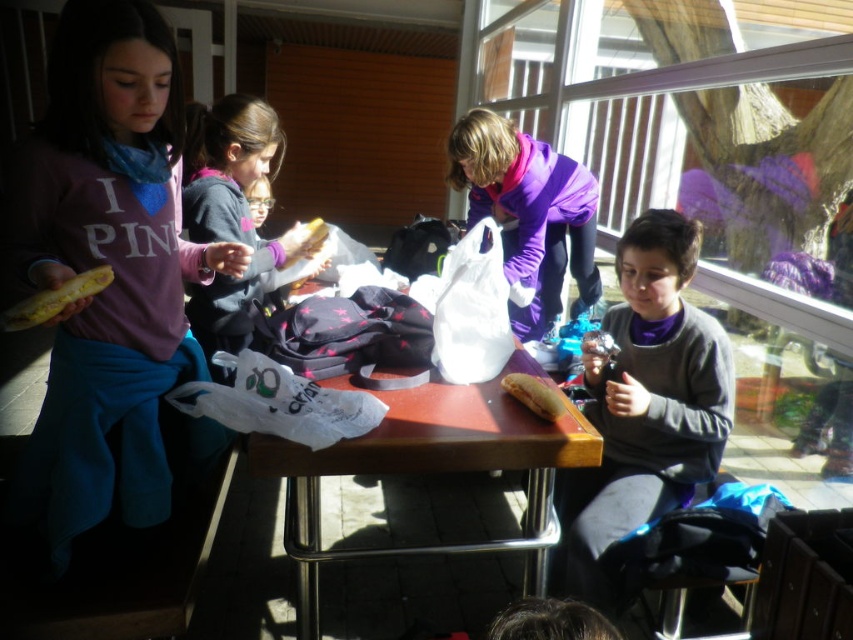
The scene shows a group of children around a table. There is a point marked at coordinates (645, 403). What object is located at that point?

The point at (645, 403) marks the gray matte sweater at center.

You are a photographer trying to capture a closeup of the yellow matte sandwich at center without the matte purple sweatshirt at left blocking the view. Given their sizes, do you think you can position yourself to frame the sandwich without the sweatshirt overlapping?

The matte purple sweatshirt at left is larger in size than the yellow matte sandwich at center. Since the sweatshirt is bigger, it might block the sandwich if positioned directly in front. To avoid overlap, move to the side where the sweatshirt doesn not obstruct the view of the sandwich.

You are a photographer trying to capture a closeup of the yellow matte sandwich at center without the gray matte sweater at center blocking the view. Based on their positions and sizes, is this possible?

The gray matte sweater at center is taller than the yellow matte sandwich at center, so it may block the sandwich if positioned directly in front. Adjust your angle to ensure the sweater doesn